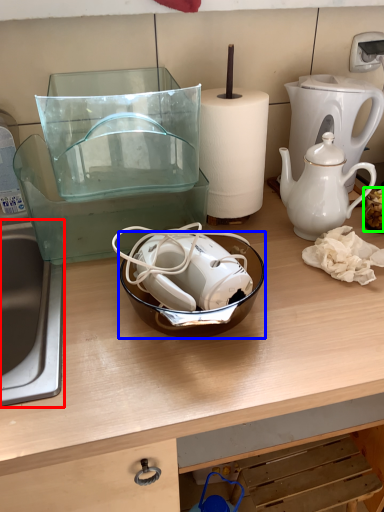
Question: Which is nearer to the sink (highlighted by a red box)? bowl (highlighted by a blue box) or food (highlighted by a green box).

Choices:
 (A) bowl
 (B) food

Answer: (A)